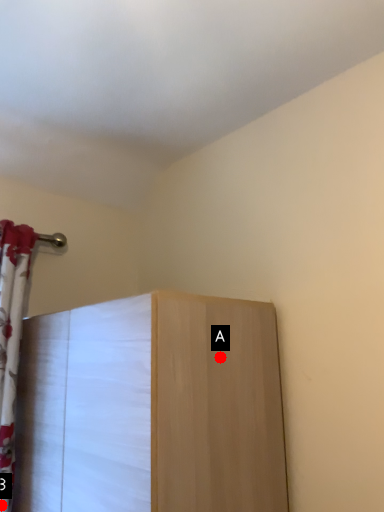
Question: Two points are circled on the image, labeled by A and B beside each circle. Which point is farther from the camera taking this photo?

Choices:
 (A) A is further
 (B) B is further

Answer: (B)